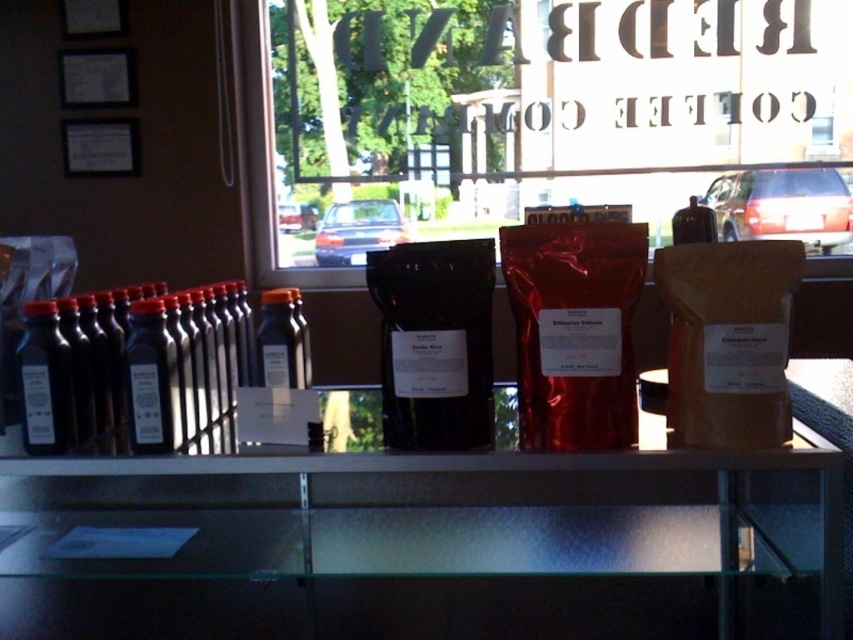
You are a customer trying to reach the coffee beans in the display case. You notice the clear glass shelf at center and the transparent glass window at center. Which part of the display case is narrower in width?

The clear glass shelf at center has a narrower width than the transparent glass window at center.

You are a customer standing in front of the display case. You want to reach the item at point (198, 506) and the item at point (152, 316). Which item should you move first to access the other?

You should move the item at point (152, 316) first because point (198, 506) is behind it, so accessing the one in front first will allow you to reach the one behind afterward.

You are a barista trying to place the black glass bottle at left onto the clear glass shelf at center. Can you fit it horizontally?

The clear glass shelf at center might be wider than black glass bottle at left, so it is possible that the black glass bottle at left can be placed horizontally on the clear glass shelf at center without overhanging the edges.